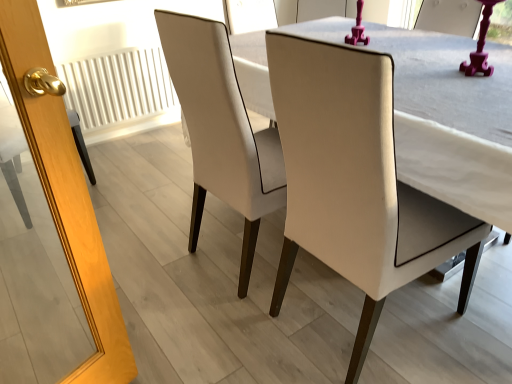
Identify the location of vacant region in front of white leather chair at center, which is the 2th chair in right-to-left order. (215, 337).